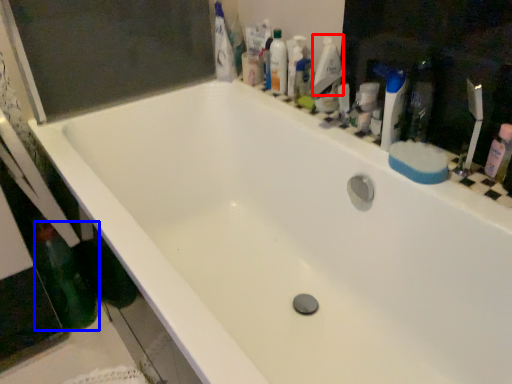
Question: Which object appears closest to the camera in this image, cleaning product (highlighted by a red box) or bottle (highlighted by a blue box)?

Choices:
 (A) cleaning product
 (B) bottle

Answer: (B)